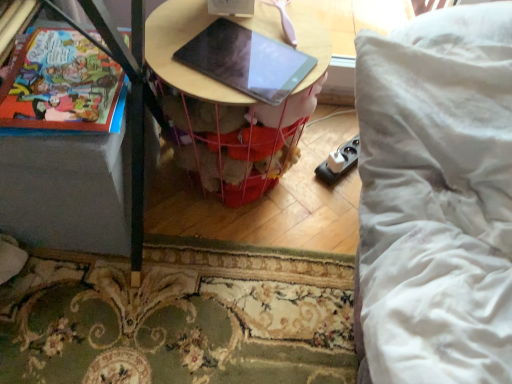
Question: Is wooden table at center at the right side of matte paper comic book at left?

Choices:
 (A) yes
 (B) no

Answer: (A)

Question: Is wooden table at center aimed at matte paper comic book at left?

Choices:
 (A) yes
 (B) no

Answer: (B)

Question: Is wooden table at center closer to camera compared to matte paper comic book at left?

Choices:
 (A) yes
 (B) no

Answer: (B)

Question: From the image's perspective, is wooden table at center located beneath matte paper comic book at left?

Choices:
 (A) yes
 (B) no

Answer: (A)

Question: Is wooden table at center shorter than matte paper comic book at left?

Choices:
 (A) no
 (B) yes

Answer: (A)

Question: From a real-world perspective, does wooden table at center sit lower than matte paper comic book at left?

Choices:
 (A) yes
 (B) no

Answer: (A)

Question: Would you say matte paper comic book at left is a long distance from matte black tablet at center?

Choices:
 (A) no
 (B) yes

Answer: (A)

Question: Is the position of matte paper comic book at left less distant than that of matte black tablet at center?

Choices:
 (A) no
 (B) yes

Answer: (B)

Question: Considering the relative sizes of matte paper comic book at left and matte black tablet at center in the image provided, is matte paper comic book at left wider than matte black tablet at center?

Choices:
 (A) no
 (B) yes

Answer: (B)

Question: Is matte paper comic book at left to the right of matte black tablet at center from the viewer's perspective?

Choices:
 (A) no
 (B) yes

Answer: (A)

Question: Is the depth of matte paper comic book at left greater than that of matte black tablet at center?

Choices:
 (A) yes
 (B) no

Answer: (B)

Question: From a real-world perspective, is matte paper comic book at left physically above matte black tablet at center?

Choices:
 (A) yes
 (B) no

Answer: (B)

Question: Is wooden table at center bigger than matte black tablet at center?

Choices:
 (A) yes
 (B) no

Answer: (A)